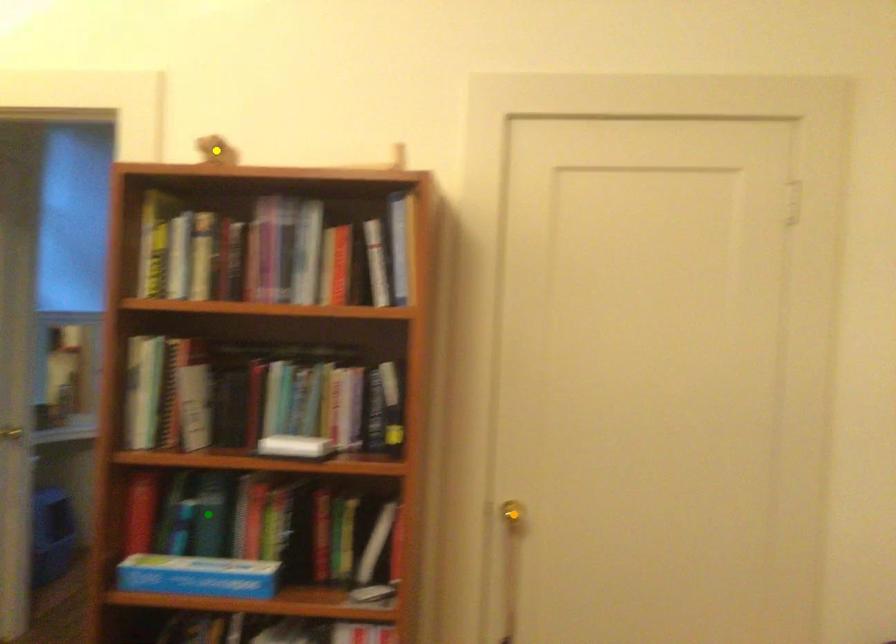
Order these from nearest to farthest:
yellow point | orange point | green point

orange point → green point → yellow point